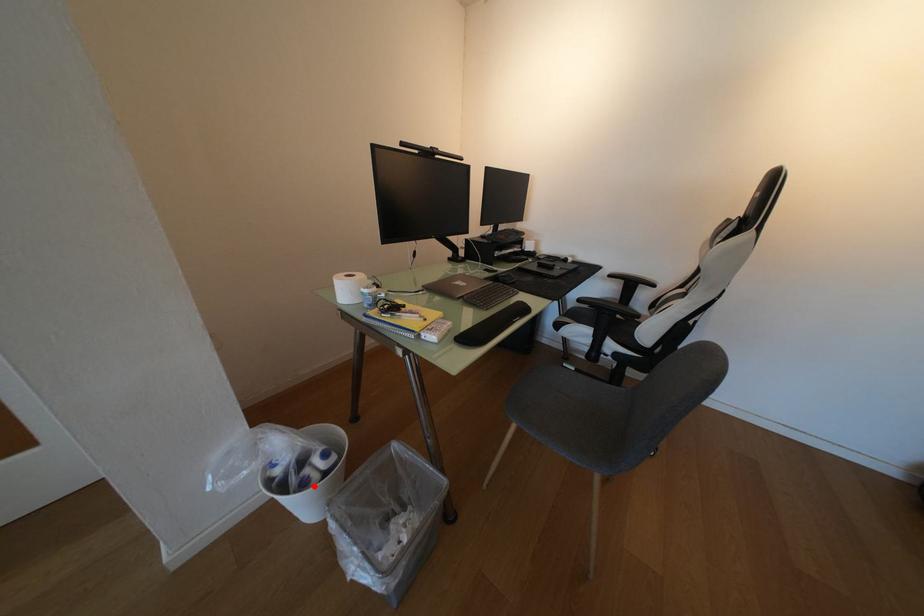
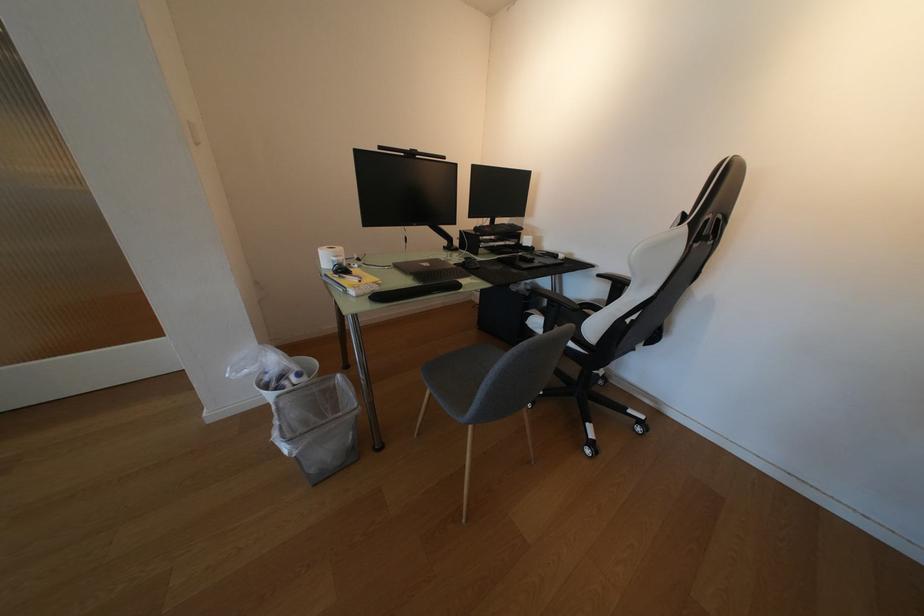
Where in the second image is the point corresponding to the highlighted location from the first image?

(288, 390)